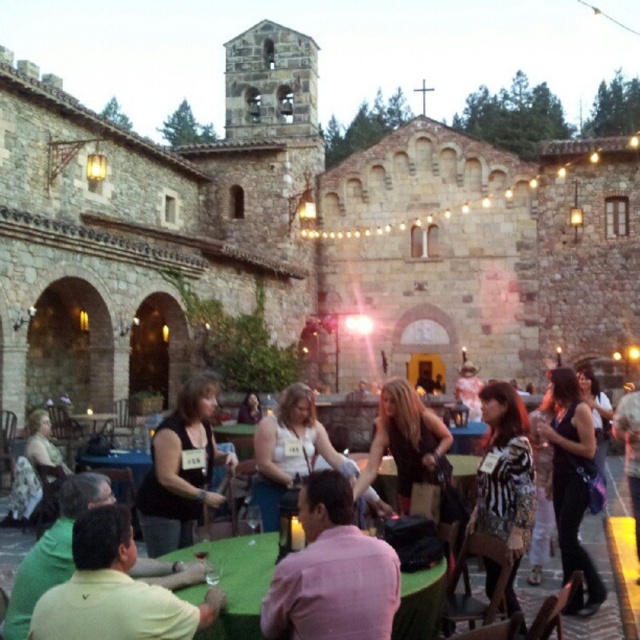
Question: Among these points, which one is farthest from the camera?

Choices:
 (A) (600, 605)
 (B) (106, 632)

Answer: (A)

Question: Which object is positioned farthest from the shiny black dress at center?

Choices:
 (A) black sleeveless top at center
 (B) pink matte shirt at center
 (C) black satin dress at center

Answer: (A)

Question: Does zebra-patterned dress at center have a smaller size compared to shiny black dress at center?

Choices:
 (A) no
 (B) yes

Answer: (A)

Question: Which of the following is the closest to the observer?

Choices:
 (A) (403, 618)
 (B) (99, 589)

Answer: (B)

Question: Can you confirm if pink matte shirt at center is positioned to the left of green fabric table at center?

Choices:
 (A) no
 (B) yes

Answer: (A)

Question: Does pink matte shirt at center have a greater width compared to zebra-patterned dress at center?

Choices:
 (A) no
 (B) yes

Answer: (A)